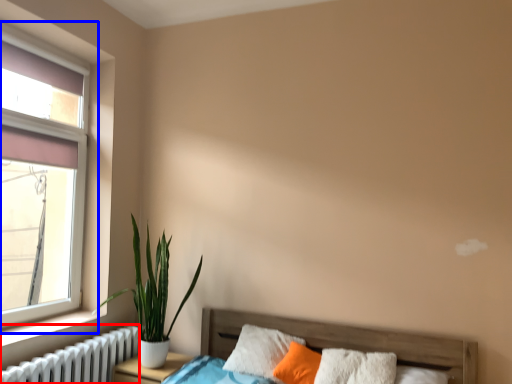
Question: Which point is closer to the camera, radiator (highlighted by a red box) or window (highlighted by a blue box)?

Choices:
 (A) radiator
 (B) window

Answer: (A)